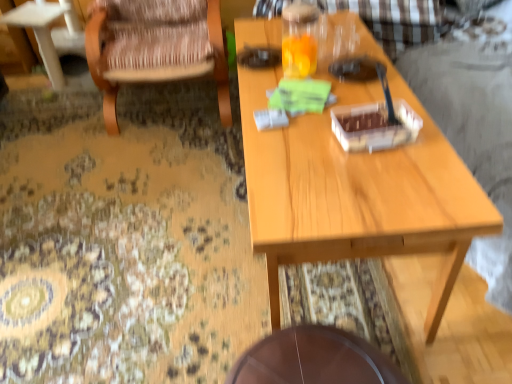
You are a GUI agent. You are given a task and a screenshot of the screen. Output one action in this format:
    pyautogui.click(x=<x>, y=<y>)
    Task: Click on the blank space situated above brown wooden table at lower center (from a real-world perspective)
    
    Given the screenshot: What is the action you would take?
    click(x=312, y=350)